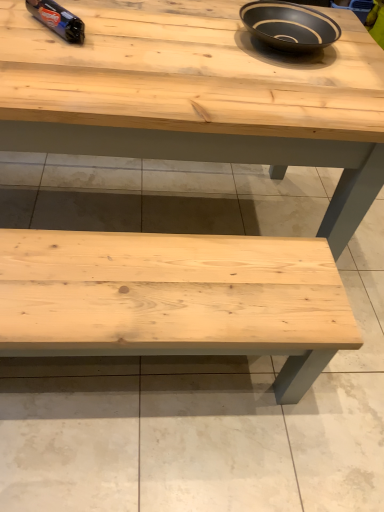
At what (x,y) coordinates should I click in order to perform the action: click on vacant area that is in front of shiny blue plastic bottle at upper left. Please return your answer as a coordinate pair (x, y). Image resolution: width=384 pixels, height=512 pixels. Looking at the image, I should click on (45, 53).